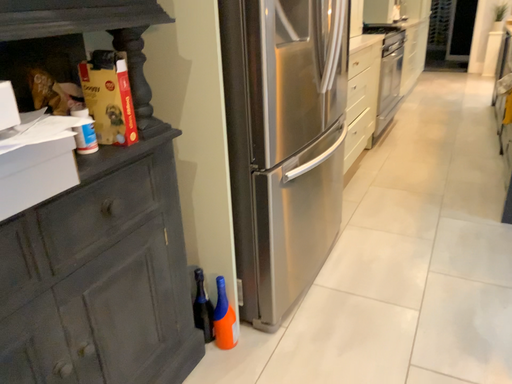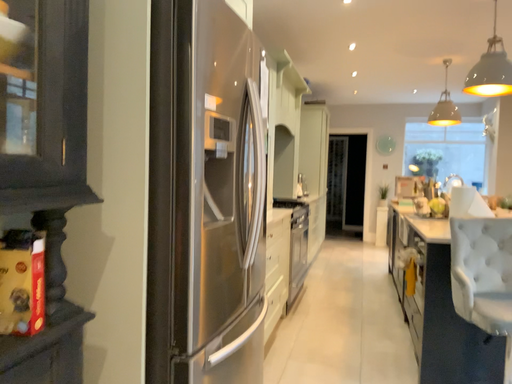
Question: How did the camera likely rotate when shooting the video?

Choices:
 (A) rotated left
 (B) rotated right

Answer: (B)